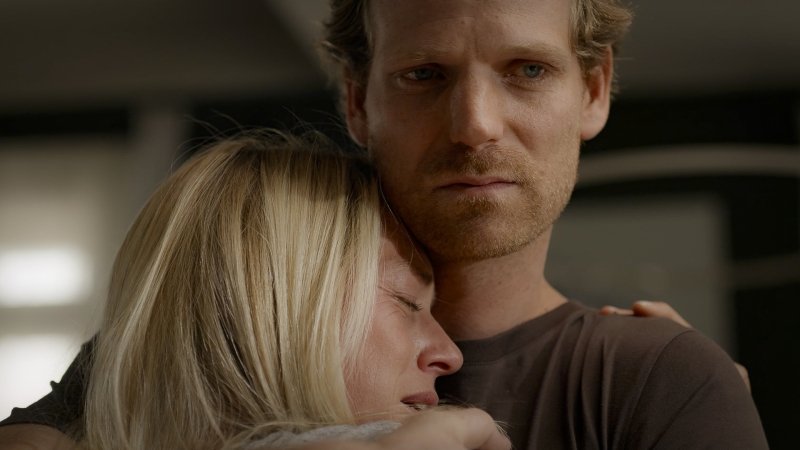
You are a GUI agent. You are given a task and a screenshot of the screen. Output one action in this format:
    pyautogui.click(x=<x>, y=<y>)
    Task: Click on the walls
    The width and height of the screenshot is (800, 450).
    Given the screenshot: What is the action you would take?
    pyautogui.click(x=770, y=244), pyautogui.click(x=94, y=132)